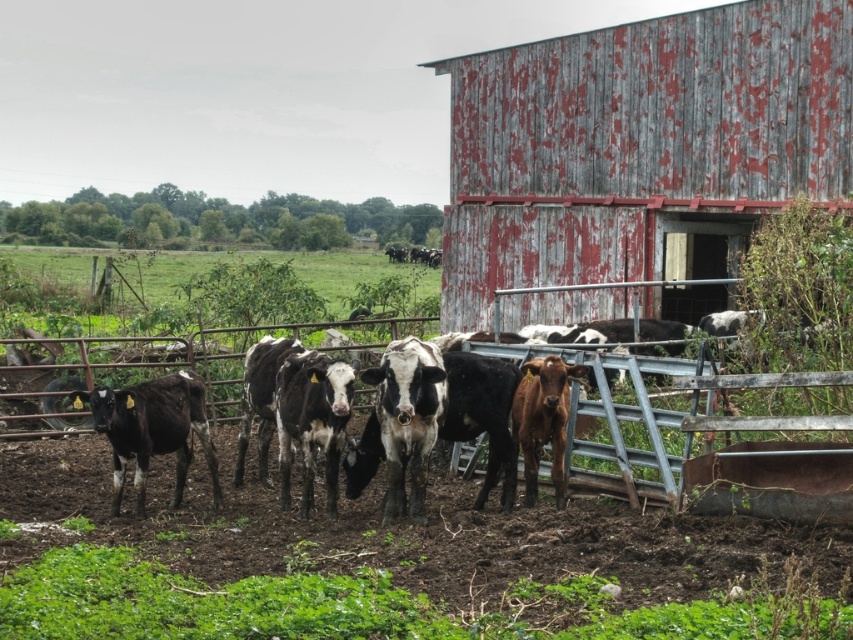
In the scene shown: You are a farmer who needs to move a new fence post between the peeling gray wood barn at right and the black glossy cow at left. Which object should you place the post closer to so that it is equidistant from both?

Since the peeling gray wood barn at right is larger in size than the black glossy cow at left, you should place the fence post closer to the peeling gray wood barn at right to ensure equal distance from both objects.